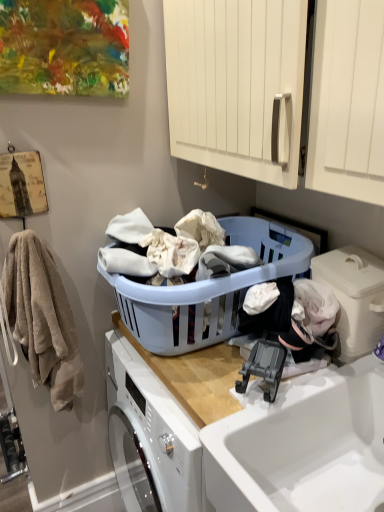
You are a GUI agent. You are given a task and a screenshot of the screen. Output one action in this format:
    pyautogui.click(x=<x>, y=<y>)
    Task: Click on the beige soft towel at left
    This screenshot has width=384, height=512.
    Given the screenshot: What is the action you would take?
    pyautogui.click(x=42, y=318)

Measure the distance between point (255,400) and camera.

The depth of point (255,400) is 39.25 inches.

Measure the distance between white glossy sink at lower right and camera.

white glossy sink at lower right is 31.54 inches away from camera.

This screenshot has height=512, width=384. Find the location of `light blue plastic laundry basket at center`. light blue plastic laundry basket at center is located at coordinates (207, 291).

At what (x,y) coordinates should I click in order to perform the action: click on beige soft towel at left. Please return your answer as a coordinate pair (x, y). Looking at the image, I should click on (42, 318).

Would you say light blue plastic laundry basket at center is to the left or to the right of white glossy sink at lower right in the picture?

From the image, it's evident that light blue plastic laundry basket at center is to the left of white glossy sink at lower right.

Can white glossy sink at lower right be found inside light blue plastic laundry basket at center?

That's incorrect, white glossy sink at lower right is not inside light blue plastic laundry basket at center.

Between point (175, 314) and point (319, 497), which one is positioned in front?

The point (319, 497) is closer.

From a real-world perspective, is light blue plastic laundry basket at center under white glossy sink at lower right?

Incorrect, from a real-world perspective, light blue plastic laundry basket at center is higher than white glossy sink at lower right.

Does beige soft towel at left lie behind white plastic container at lower right?

That is True.

Is beige soft towel at left oriented away from white plastic container at lower right?

No, beige soft towel at left's orientation is not away from white plastic container at lower right.

How distant is beige soft towel at left from white plastic container at lower right?

beige soft towel at left and white plastic container at lower right are 31.66 inches apart.

Between point (9, 277) and point (365, 326), which one is positioned in front?

Positioned in front is point (365, 326).

Considering the sizes of light blue plastic laundry basket at center and beige soft towel at left in the image, is light blue plastic laundry basket at center taller or shorter than beige soft towel at left?

Considering their sizes, light blue plastic laundry basket at center has less height than beige soft towel at left.

Considering the relative sizes of light blue plastic laundry basket at center and beige soft towel at left in the image provided, is light blue plastic laundry basket at center smaller than beige soft towel at left?

Incorrect, light blue plastic laundry basket at center is not smaller in size than beige soft towel at left.

Which is correct: light blue plastic laundry basket at center is inside beige soft towel at left, or outside of it?

light blue plastic laundry basket at center cannot be found inside beige soft towel at left.

Does light blue plastic laundry basket at center turn towards beige soft towel at left?

Yes, light blue plastic laundry basket at center is aimed at beige soft towel at left.

From the image's perspective, is white plastic container at lower right located above white glossy sink at lower right?

Yes, from the image's perspective, white plastic container at lower right is above white glossy sink at lower right.

Could you tell me if white plastic container at lower right is facing white glossy sink at lower right?

No, white plastic container at lower right does not turn towards white glossy sink at lower right.

Can we say white plastic container at lower right lies outside white glossy sink at lower right?

white plastic container at lower right is positioned outside white glossy sink at lower right.

Is white plastic container at lower right wider than white glossy sink at lower right?

No.

In terms of height, does beige soft towel at left look taller or shorter compared to white glossy sink at lower right?

beige soft towel at left is taller than white glossy sink at lower right.

Is beige soft towel at left not within white glossy sink at lower right?

Indeed, beige soft towel at left is completely outside white glossy sink at lower right.

Is beige soft towel at left bigger or smaller than white glossy sink at lower right?

In the image, beige soft towel at left appears to be smaller than white glossy sink at lower right.

Which is more distant, (10, 243) or (147, 324)?

The point (10, 243) is more distant.

From a real-world perspective, is beige soft towel at left over light blue plastic laundry basket at center?

Incorrect, from a real-world perspective, beige soft towel at left is lower than light blue plastic laundry basket at center.

Is beige soft towel at left bigger or smaller than light blue plastic laundry basket at center?

In the image, beige soft towel at left appears to be smaller than light blue plastic laundry basket at center.

From the picture: Is light blue plastic laundry basket at center behind white plastic container at lower right?

No, light blue plastic laundry basket at center is closer to the viewer.

How much distance is there between light blue plastic laundry basket at center and white plastic container at lower right?

10.54 inches.

Is point (146, 331) more distant than point (356, 263)?

That is True.

Is light blue plastic laundry basket at center far from white plastic container at lower right?

No, light blue plastic laundry basket at center is not far away from white plastic container at lower right.

Find the location of a particular element. This screenshot has width=384, height=512. laundry basket lying on the left of white glossy sink at lower right is located at coordinates (207, 291).

At what (x,y) coordinates should I click in order to perform the action: click on clothing below the white plastic container at lower right (from a real-world perspective). Please return your answer as a coordinate pair (x, y). The width and height of the screenshot is (384, 512). Looking at the image, I should click on (42, 318).

Which object lies nearer to the anchor point white plastic container at lower right, white glossy sink at lower right or light blue plastic laundry basket at center?

white glossy sink at lower right is positioned closer to the anchor white plastic container at lower right.

When comparing their distances from light blue plastic laundry basket at center, does beige soft towel at left or white glossy sink at lower right seem further?

white glossy sink at lower right.

Considering their positions, is light blue plastic laundry basket at center positioned further to white glossy sink at lower right than white plastic container at lower right?

Among the two, light blue plastic laundry basket at center is located further to white glossy sink at lower right.

Looking at the image, which one is located further to light blue plastic laundry basket at center, white glossy sink at lower right or beige soft towel at left?

Based on the image, white glossy sink at lower right appears to be further to light blue plastic laundry basket at center.

Looking at this image, when comparing their distances from white plastic container at lower right, does beige soft towel at left or light blue plastic laundry basket at center seem closer?

light blue plastic laundry basket at center lies closer to white plastic container at lower right than the other object.

Considering their positions, is light blue plastic laundry basket at center positioned closer to white plastic container at lower right than white glossy sink at lower right?

white glossy sink at lower right is closer to white plastic container at lower right.

Looking at this image, from the image, which object appears to be nearer to beige soft towel at left, white glossy sink at lower right or white plastic container at lower right?

white glossy sink at lower right is closer to beige soft towel at left.

In the scene shown: Looking at the image, which one is located closer to beige soft towel at left, white glossy sink at lower right or light blue plastic laundry basket at center?

light blue plastic laundry basket at center is closer to beige soft towel at left.

Where is `washing machine between light blue plastic laundry basket at center and white glossy sink at lower right in the vertical direction`? Image resolution: width=384 pixels, height=512 pixels. washing machine between light blue plastic laundry basket at center and white glossy sink at lower right in the vertical direction is located at coordinates pyautogui.click(x=354, y=296).

Where is `sink situated between beige soft towel at left and white plastic container at lower right from left to right`? The image size is (384, 512). sink situated between beige soft towel at left and white plastic container at lower right from left to right is located at coordinates (302, 445).

Identify the location of laundry basket between beige soft towel at left and white plastic container at lower right in the horizontal direction. (207, 291).

I want to click on laundry basket between beige soft towel at left and white glossy sink at lower right in the horizontal direction, so click(207, 291).